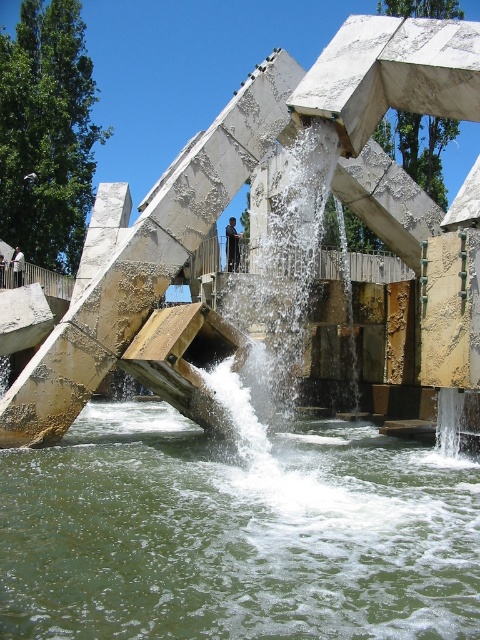
You are standing at the entrance of the water feature area and want to take a photo of the white concrete dam at center. According to the coordinates provided, where should you position yourself to capture the dam in the frame?

The white concrete dam at center is located at point (238, 188), so you should position yourself at that coordinate to capture it in the frame.